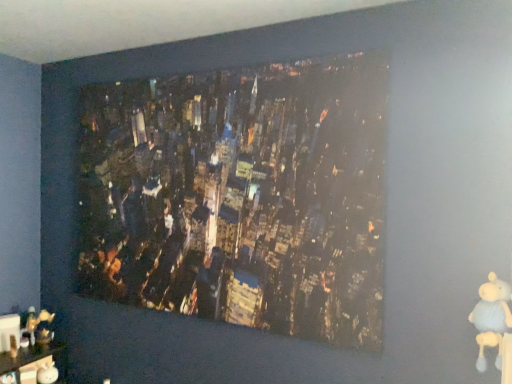
Question: From the image's perspective, is white plush bear at lower right below wooden figurine at lower left?

Choices:
 (A) no
 (B) yes

Answer: (A)

Question: Is white plush bear at lower right not near wooden figurine at lower left?

Choices:
 (A) no
 (B) yes

Answer: (B)

Question: Is white plush bear at lower right positioned with its back to wooden figurine at lower left?

Choices:
 (A) no
 (B) yes

Answer: (A)

Question: From a real-world perspective, does white plush bear at lower right stand above wooden figurine at lower left?

Choices:
 (A) no
 (B) yes

Answer: (B)

Question: Is white plush bear at lower right facing towards wooden figurine at lower left?

Choices:
 (A) no
 (B) yes

Answer: (A)

Question: Is white plush bear at lower right bigger than wooden figurine at lower left?

Choices:
 (A) no
 (B) yes

Answer: (A)

Question: From a real-world perspective, is wooden figurine at lower left located beneath white plush bear at lower right?

Choices:
 (A) yes
 (B) no

Answer: (A)

Question: Does wooden figurine at lower left have a lesser height compared to white plush bear at lower right?

Choices:
 (A) no
 (B) yes

Answer: (B)

Question: Is wooden figurine at lower left touching white plush bear at lower right?

Choices:
 (A) no
 (B) yes

Answer: (A)

Question: From the image's perspective, would you say wooden figurine at lower left is positioned over white plush bear at lower right?

Choices:
 (A) no
 (B) yes

Answer: (A)

Question: Considering the relative sizes of wooden figurine at lower left and white plush bear at lower right in the image provided, is wooden figurine at lower left smaller than white plush bear at lower right?

Choices:
 (A) no
 (B) yes

Answer: (A)

Question: Is wooden figurine at lower left not within white plush bear at lower right?

Choices:
 (A) yes
 (B) no

Answer: (A)

Question: Does matte cityscape print at center turn towards white plush bear at lower right?

Choices:
 (A) no
 (B) yes

Answer: (A)